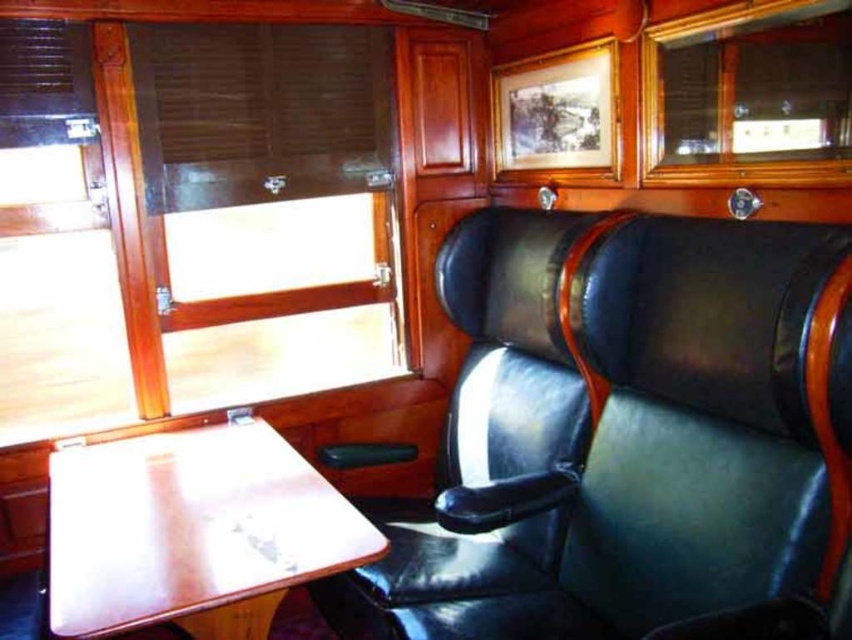
Is point (452, 536) closer to camera compared to point (562, 154)?

Yes, it is in front of point (562, 154).

Who is positioned more to the left, black leather chair at center or wooden frame picture at upper center?

Positioned to the left is black leather chair at center.

You are a GUI agent. You are given a task and a screenshot of the screen. Output one action in this format:
    pyautogui.click(x=<x>, y=<y>)
    Task: Click on the black leather chair at center
    
    Given the screenshot: What is the action you would take?
    pyautogui.click(x=488, y=433)

At what (x,y) coordinates should I click in order to perform the action: click on black leather chair at center. Please return your answer as a coordinate pair (x, y). This screenshot has height=640, width=852. Looking at the image, I should click on (488, 433).

Is wooden panel at upper left above wooden table at lower left?

Indeed, wooden panel at upper left is positioned over wooden table at lower left.

Is wooden panel at upper left further to camera compared to wooden table at lower left?

Yes, wooden panel at upper left is further from the viewer.

Is point (392, 205) more distant than point (151, 484)?

Yes.

Locate an element on the screen. The image size is (852, 640). wooden panel at upper left is located at coordinates (269, 205).

Locate an element on the screen. wooden panel at upper left is located at coordinates (269, 205).

Does wooden panel at upper left appear over transparent glass window at upper center?

Actually, wooden panel at upper left is below transparent glass window at upper center.

Does point (263, 176) come behind point (653, 154)?

Yes, point (263, 176) is farther from viewer.

Locate an element on the screen. This screenshot has width=852, height=640. wooden panel at upper left is located at coordinates [269, 205].